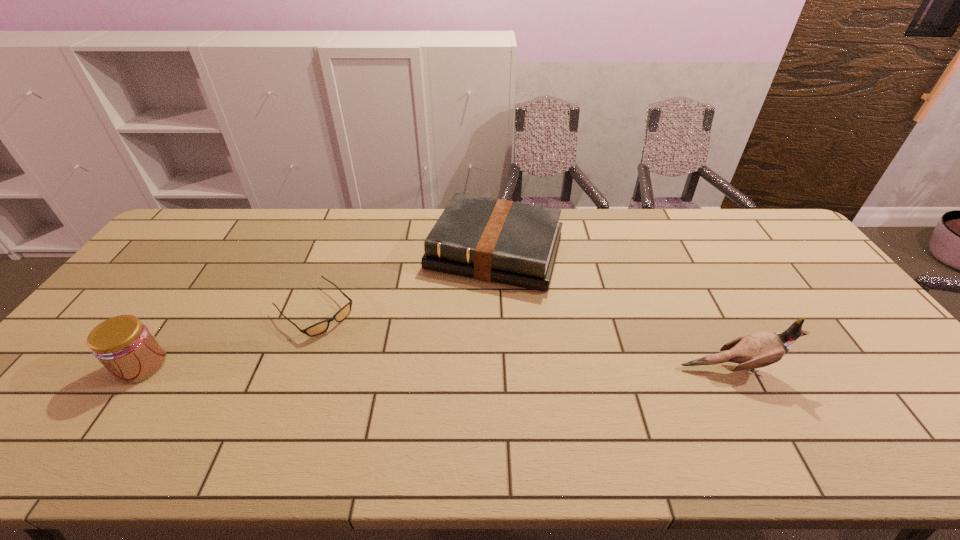
You are a GUI agent. You are given a task and a screenshot of the screen. Output one action in this format:
    pyautogui.click(x=<x>, y=<y>)
    Task: Click on the free spot located 0.350m on the front-facing side of the sunglasses
    Image resolution: width=960 pixels, height=540 pixels.
    Given the screenshot: What is the action you would take?
    pyautogui.click(x=422, y=409)

Find the location of a particular element. vacant point located on the front-facing side of the sunglasses is located at coordinates (408, 396).

You are a GUI agent. You are given a task and a screenshot of the screen. Output one action in this format:
    pyautogui.click(x=<x>, y=<y>)
    Task: Click on the vacant space situated on the front-facing side of the sunglasses
    The image size is (960, 540).
    Given the screenshot: What is the action you would take?
    pyautogui.click(x=400, y=389)

What are the coordinates of `free spot located 0.070m on the spine side of the third tallest object` in the screenshot? It's located at (469, 309).

The height and width of the screenshot is (540, 960). Identify the location of free location located on the spine side of the third tallest object. pyautogui.click(x=460, y=332).

The width and height of the screenshot is (960, 540). I want to click on vacant position located 0.320m on the spine side of the third tallest object, so click(x=441, y=380).

Find the location of `object that is at the far edge`. object that is at the far edge is located at coordinates tap(494, 240).

I want to click on object located at the near edge, so click(x=126, y=348).

At what (x,y) coordinates should I click in order to perform the action: click on object that is at the left edge. Please return your answer as a coordinate pair (x, y). Looking at the image, I should click on (126, 348).

Locate an element on the screen. The width and height of the screenshot is (960, 540). object that is at the near left corner is located at coordinates (126, 348).